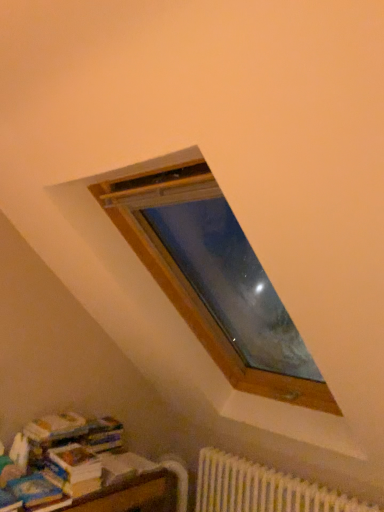
Question: Is white paper book at lower left at the left side of blue matte paperback book at lower left?

Choices:
 (A) no
 (B) yes

Answer: (A)

Question: Would you consider white paper book at lower left to be distant from blue matte paperback book at lower left?

Choices:
 (A) no
 (B) yes

Answer: (A)

Question: Is white paper book at lower left wider than blue matte paperback book at lower left?

Choices:
 (A) yes
 (B) no

Answer: (B)

Question: Is white paper book at lower left looking in the opposite direction of blue matte paperback book at lower left?

Choices:
 (A) no
 (B) yes

Answer: (A)

Question: From a real-world perspective, is white paper book at lower left physically below blue matte paperback book at lower left?

Choices:
 (A) no
 (B) yes

Answer: (A)

Question: Is white paper book at lower left thinner than blue matte paperback book at lower left?

Choices:
 (A) yes
 (B) no

Answer: (A)

Question: From the image's perspective, is blue matte paperback book at lower left above white plastic radiator at lower right?

Choices:
 (A) yes
 (B) no

Answer: (A)

Question: Does blue matte paperback book at lower left have a larger size compared to white plastic radiator at lower right?

Choices:
 (A) no
 (B) yes

Answer: (A)

Question: Is blue matte paperback book at lower left shorter than white plastic radiator at lower right?

Choices:
 (A) no
 (B) yes

Answer: (B)

Question: Does blue matte paperback book at lower left have a greater width compared to white plastic radiator at lower right?

Choices:
 (A) yes
 (B) no

Answer: (A)

Question: Is blue matte paperback book at lower left to the left of white plastic radiator at lower right from the viewer's perspective?

Choices:
 (A) no
 (B) yes

Answer: (B)

Question: Can you confirm if blue matte paperback book at lower left is smaller than white plastic radiator at lower right?

Choices:
 (A) yes
 (B) no

Answer: (A)

Question: From the image's perspective, is blue matte paperback book at lower left under white paper book at lower left?

Choices:
 (A) yes
 (B) no

Answer: (A)